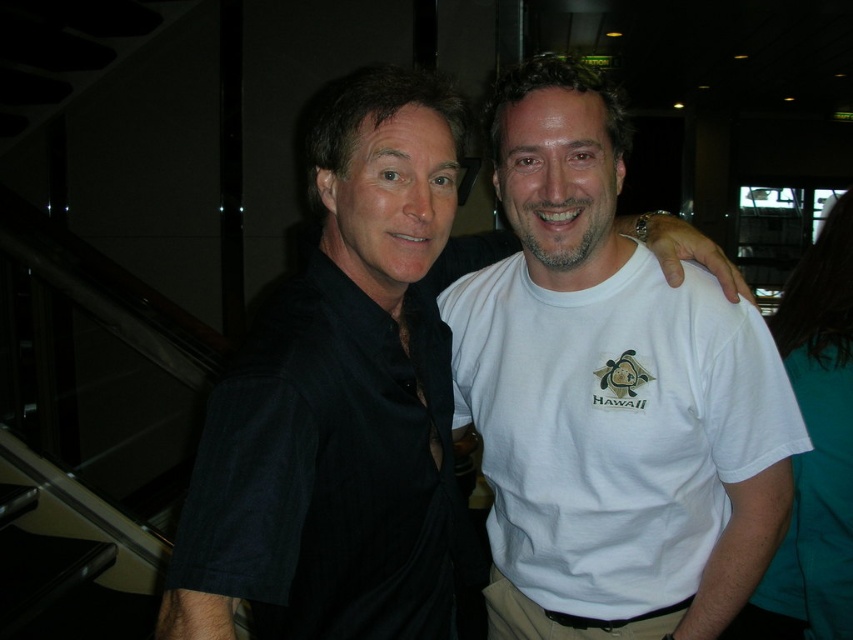
Is white cotton t-shirt at center wider than black matte shirt at center?

Yes.

Is white cotton t-shirt at center behind black matte shirt at center?

Yes, white cotton t-shirt at center is behind black matte shirt at center.

Find the location of a particular element. white cotton t-shirt at center is located at coordinates (610, 396).